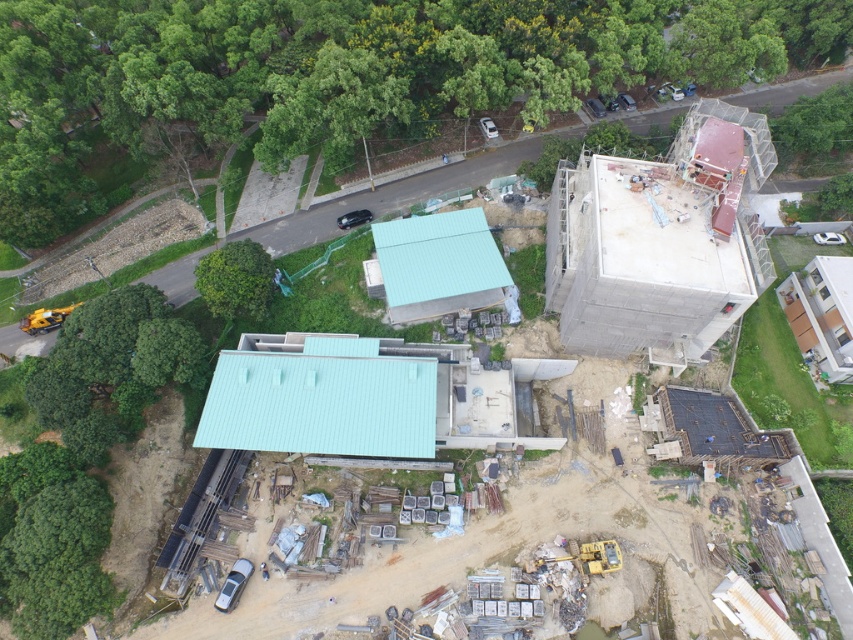
You are a drone operator tasked with capturing aerial footage of the construction site. Your drone has a maximum flight range of 70 meters. You want to fly the drone to the green leafy tree at upper left to capture a shot. Can the drone reach the tree without exceeding its maximum range?

The green leafy tree at upper left is 70.48 meters away from viewer. Since the drone has a maximum flight range of 70 meters, it cannot reach the tree without exceeding its range.

You are a drone operator tasked with capturing aerial footage of the construction site. You need to ensure that the green leafy tree at upper left and the green leafy tree at center are both visible in your shot. Based on their sizes, which tree will appear larger in the final footage?

The green leafy tree at upper left is bigger than the green leafy tree at center, so it will appear larger in the final footage.